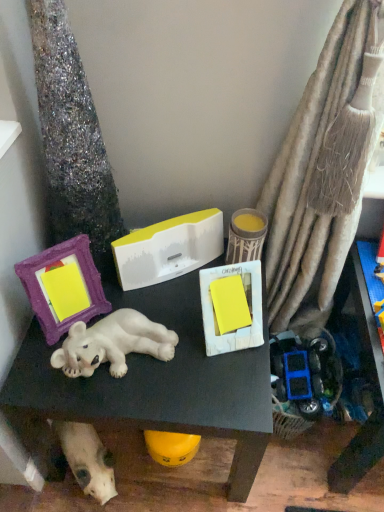
Question: Does white glossy polar bear at center have a lesser width compared to purple fabric picture frame at left?

Choices:
 (A) no
 (B) yes

Answer: (A)

Question: From a real-world perspective, is white glossy polar bear at center positioned over purple fabric picture frame at left based on gravity?

Choices:
 (A) yes
 (B) no

Answer: (B)

Question: From the image's perspective, is white glossy polar bear at center located beneath purple fabric picture frame at left?

Choices:
 (A) no
 (B) yes

Answer: (B)

Question: Is white glossy polar bear at center positioned before purple fabric picture frame at left?

Choices:
 (A) yes
 (B) no

Answer: (B)

Question: Can you confirm if white glossy polar bear at center is bigger than purple fabric picture frame at left?

Choices:
 (A) no
 (B) yes

Answer: (B)

Question: From a real-world perspective, is matte yellow candle at center above or below purple fabric picture frame at left?

Choices:
 (A) above
 (B) below

Answer: (B)

Question: In terms of width, does matte yellow candle at center look wider or thinner when compared to purple fabric picture frame at left?

Choices:
 (A) wide
 (B) thin

Answer: (A)

Question: From the image's perspective, relative to purple fabric picture frame at left, is matte yellow candle at center above or below?

Choices:
 (A) above
 (B) below

Answer: (A)

Question: From their relative heights in the image, would you say matte yellow candle at center is taller or shorter than purple fabric picture frame at left?

Choices:
 (A) short
 (B) tall

Answer: (A)

Question: From the image's perspective, relative to purple fabric picture frame at left, is white matte dog at lower left above or below?

Choices:
 (A) below
 (B) above

Answer: (A)

Question: Considering the positions of point (87, 448) and point (92, 314), is point (87, 448) closer or farther from the camera than point (92, 314)?

Choices:
 (A) closer
 (B) farther

Answer: (B)

Question: Based on their sizes in the image, would you say white matte dog at lower left is bigger or smaller than purple fabric picture frame at left?

Choices:
 (A) big
 (B) small

Answer: (A)

Question: Is white matte dog at lower left taller or shorter than purple fabric picture frame at left?

Choices:
 (A) short
 (B) tall

Answer: (A)

Question: From the image's perspective, is purple fabric picture frame at left positioned above or below white matte dog at lower left?

Choices:
 (A) above
 (B) below

Answer: (A)

Question: Is purple fabric picture frame at left inside the boundaries of white matte dog at lower left, or outside?

Choices:
 (A) outside
 (B) inside

Answer: (A)